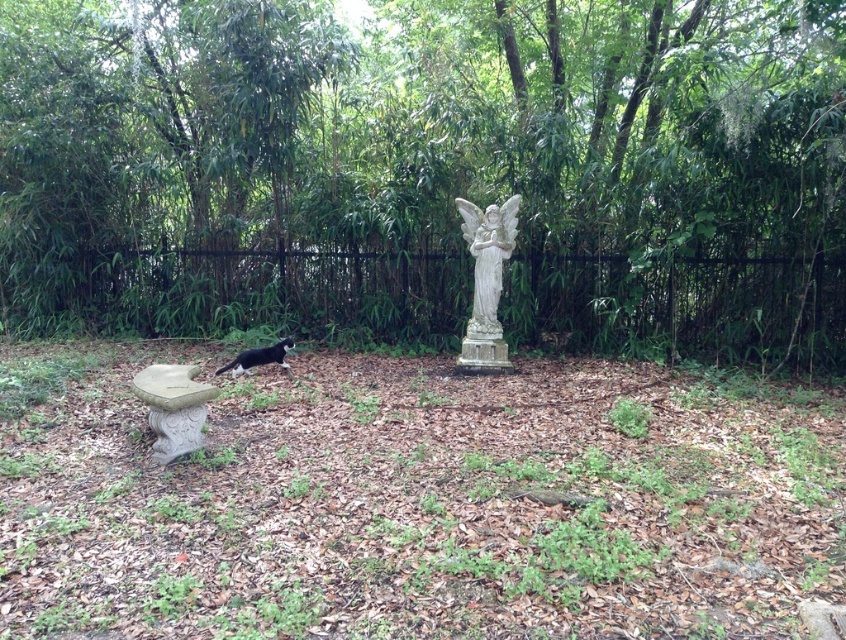
You are standing in the garden and want to walk from the black metal fence at center to the black and white fur cat at lower left. Which direction should you move?

The black metal fence at center is to the left of the black and white fur cat at lower left, so you should move to the right to reach the cat.

You are a photographer wanting to capture both the white stone statue at center and the black and white fur cat at lower left in the same frame. Based on their positions, which object is closer to the camera?

The black and white fur cat at lower left is closer to the camera since the white stone statue at center is located below it.

You are standing at the origin point in the garden. The white stone statue at center is located at coordinates 0.783, 0.492. If you want to walk directly to the statue, which direction should you head?

Since the white stone statue at center is located at coordinates (415,500), you should head towards the northeast direction to reach it.